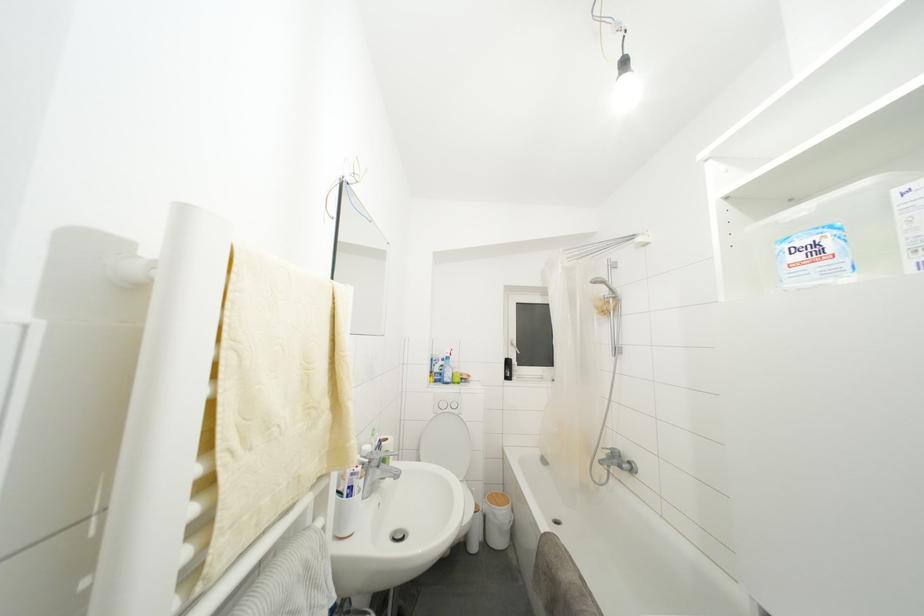
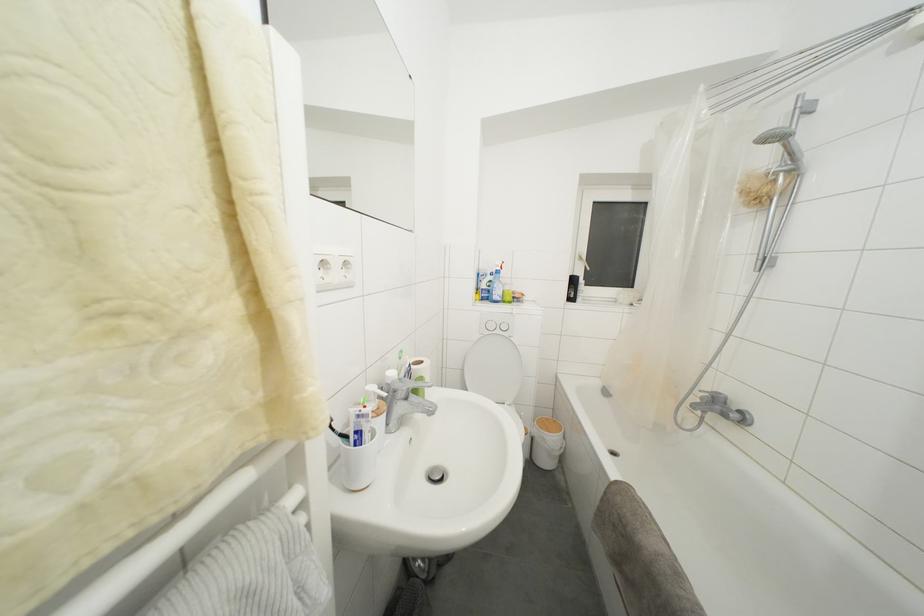
Locate, in the second image, the point that corresponds to pixel 513 368 in the first image.

(578, 286)